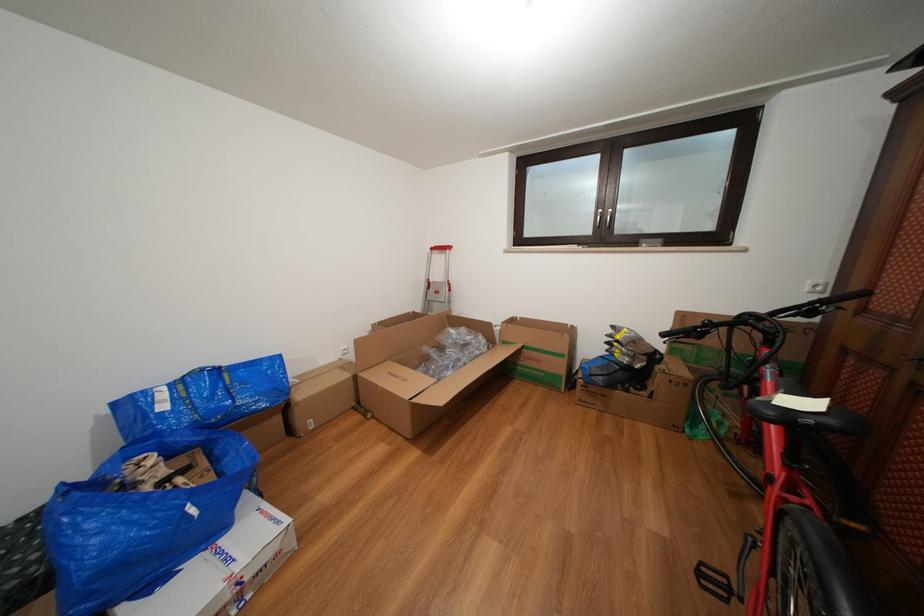
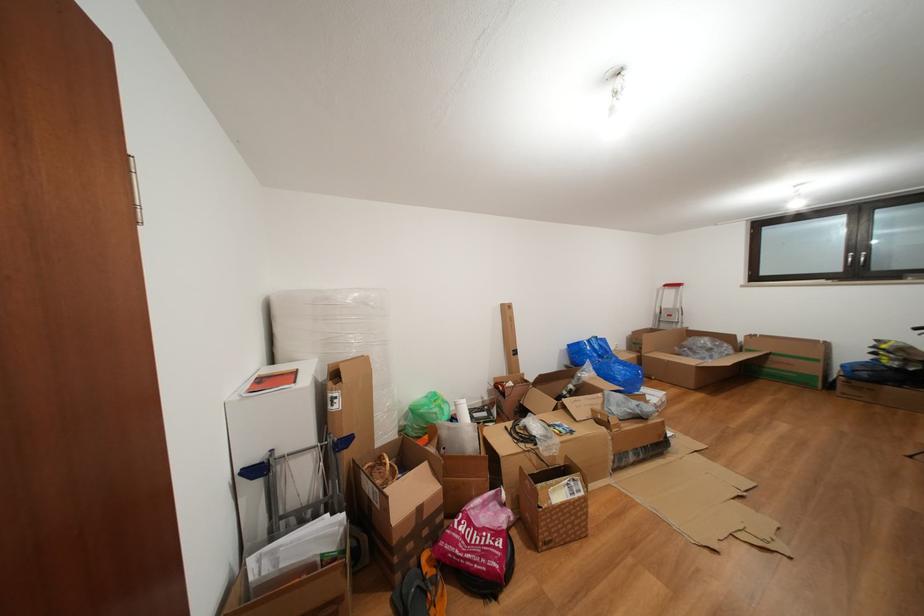
In the second image, find the point that corresponds to point (618, 392) in the first image.

(886, 387)